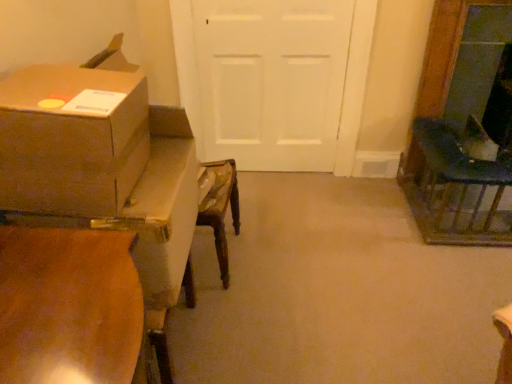
The width and height of the screenshot is (512, 384). What do you see at coordinates (272, 80) in the screenshot? I see `white matte door at center` at bounding box center [272, 80].

The image size is (512, 384). What do you see at coordinates (457, 162) in the screenshot?
I see `dark green fabric chair at right` at bounding box center [457, 162].

Image resolution: width=512 pixels, height=384 pixels. Describe the element at coordinates (111, 191) in the screenshot. I see `wooden table at left` at that location.

Identify the location of brown cardboard box at left. This screenshot has height=384, width=512. (70, 141).

Describe the element at coordinates (70, 141) in the screenshot. I see `brown cardboard box at left` at that location.

Locate an element on the screen. Image resolution: width=512 pixels, height=384 pixels. white matte door at center is located at coordinates (272, 80).

Is wooden table at left far from white matte door at center?

Yes, wooden table at left and white matte door at center are quite far apart.

Does wooden table at left have a larger size compared to white matte door at center?

Correct, wooden table at left is larger in size than white matte door at center.

Is white matte door at center a part of wooden table at left?

No.

Is wooden table at left to the left or to the right of white matte door at center in the image?

wooden table at left is to the left of white matte door at center.

The height and width of the screenshot is (384, 512). In the image, there is a brown cardboard box at left. What are the coordinates of `door below it (from a real-world perspective)` in the screenshot? It's located at (272, 80).

Considering the sizes of objects brown cardboard box at left and white matte door at center in the image provided, who is smaller, brown cardboard box at left or white matte door at center?

brown cardboard box at left is smaller.

From the image's perspective, relative to white matte door at center, is brown cardboard box at left above or below?

From the image's perspective, brown cardboard box at left appears below white matte door at center.

Considering the relative sizes of dark green fabric chair at right and wooden table at left in the image provided, is dark green fabric chair at right thinner than wooden table at left?

In fact, dark green fabric chair at right might be wider than wooden table at left.

From a real-world perspective, which is physically below, dark green fabric chair at right or wooden table at left?

From a 3D spatial view, dark green fabric chair at right is below.

Between dark green fabric chair at right and wooden table at left, which one is positioned behind?

dark green fabric chair at right.

Would you consider dark green fabric chair at right to be distant from wooden table at left?

Absolutely, dark green fabric chair at right is distant from wooden table at left.

Locate an element on the screen. box on the left of dark green fabric chair at right is located at coordinates (70, 141).

Is brown cardboard box at left not near dark green fabric chair at right?

Absolutely, brown cardboard box at left is distant from dark green fabric chair at right.

Is point (137, 157) closer or farther from the camera than point (447, 164)?

Point (137, 157) is positioned closer to the camera compared to point (447, 164).

Is brown cardboard box at left located outside dark green fabric chair at right?

Yes, brown cardboard box at left is outside of dark green fabric chair at right.

Considering the relative sizes of dark green fabric chair at right and white matte door at center in the image provided, is dark green fabric chair at right taller than white matte door at center?

Incorrect, the height of dark green fabric chair at right is not larger of that of white matte door at center.

Is dark green fabric chair at right not close to white matte door at center?

They are positioned close to each other.

Considering the positions of objects dark green fabric chair at right and white matte door at center in the image provided, who is more to the right, dark green fabric chair at right or white matte door at center?

dark green fabric chair at right is more to the right.

Which of these two, dark green fabric chair at right or white matte door at center, is bigger?

dark green fabric chair at right is bigger.

From the image's perspective, which object appears higher, white matte door at center or wooden table at left?

From the image's view, white matte door at center is above.

Is white matte door at center positioned beyond the bounds of wooden table at left?

That's correct, white matte door at center is outside of wooden table at left.

Is white matte door at center further to camera compared to wooden table at left?

Yes, white matte door at center is further from the camera.

Is point (335, 66) closer to viewer compared to point (65, 99)?

No, (335, 66) is further to viewer.

Based on the photo, is white matte door at center facing towards brown cardboard box at left?

Yes.

How many degrees apart are the facing directions of white matte door at center and brown cardboard box at left?

The facing directions of white matte door at center and brown cardboard box at left are 91.7 degrees apart.

From a real-world perspective, is white matte door at center positioned over brown cardboard box at left based on gravity?

Incorrect, from a real-world perspective, white matte door at center is lower than brown cardboard box at left.

The image size is (512, 384). What are the coordinates of `table below the white matte door at center (from the image's perspective)` in the screenshot? It's located at (111, 191).

You are a GUI agent. You are given a task and a screenshot of the screen. Output one action in this format:
    pyautogui.click(x=<x>, y=<y>)
    Task: Click on the box that is on the left side of white matte door at center
    
    Given the screenshot: What is the action you would take?
    pyautogui.click(x=70, y=141)

When comparing their distances from white matte door at center, does dark green fabric chair at right or brown cardboard box at left seem closer?

dark green fabric chair at right is closer to white matte door at center.

Estimate the real-world distances between objects in this image. Which object is closer to brown cardboard box at left, white matte door at center or dark green fabric chair at right?

white matte door at center is positioned closer to the anchor brown cardboard box at left.

Based on their spatial positions, is white matte door at center or wooden table at left closer to dark green fabric chair at right?

white matte door at center is closer to dark green fabric chair at right.

Which object lies nearer to the anchor point brown cardboard box at left, wooden table at left or white matte door at center?

wooden table at left is positioned closer to the anchor brown cardboard box at left.

When comparing their distances from dark green fabric chair at right, does wooden table at left or brown cardboard box at left seem further?

The object further to dark green fabric chair at right is brown cardboard box at left.

Looking at the image, which one is located further to wooden table at left, white matte door at center or brown cardboard box at left?

Based on the image, white matte door at center appears to be further to wooden table at left.

Based on their spatial positions, is white matte door at center or wooden table at left closer to brown cardboard box at left?

Based on the image, wooden table at left appears to be nearer to brown cardboard box at left.

Based on their spatial positions, is white matte door at center or dark green fabric chair at right closer to wooden table at left?

Based on the image, white matte door at center appears to be nearer to wooden table at left.

Identify the location of table located between brown cardboard box at left and dark green fabric chair at right in the left-right direction. Image resolution: width=512 pixels, height=384 pixels. (111, 191).

At what (x,y) coordinates should I click in order to perform the action: click on box between wooden table at left and white matte door at center along the z-axis. Please return your answer as a coordinate pair (x, y). Looking at the image, I should click on (70, 141).

At what (x,y) coordinates should I click in order to perform the action: click on door between wooden table at left and dark green fabric chair at right. Please return your answer as a coordinate pair (x, y). The width and height of the screenshot is (512, 384). Looking at the image, I should click on (272, 80).

The width and height of the screenshot is (512, 384). I want to click on door situated between brown cardboard box at left and dark green fabric chair at right from left to right, so click(272, 80).